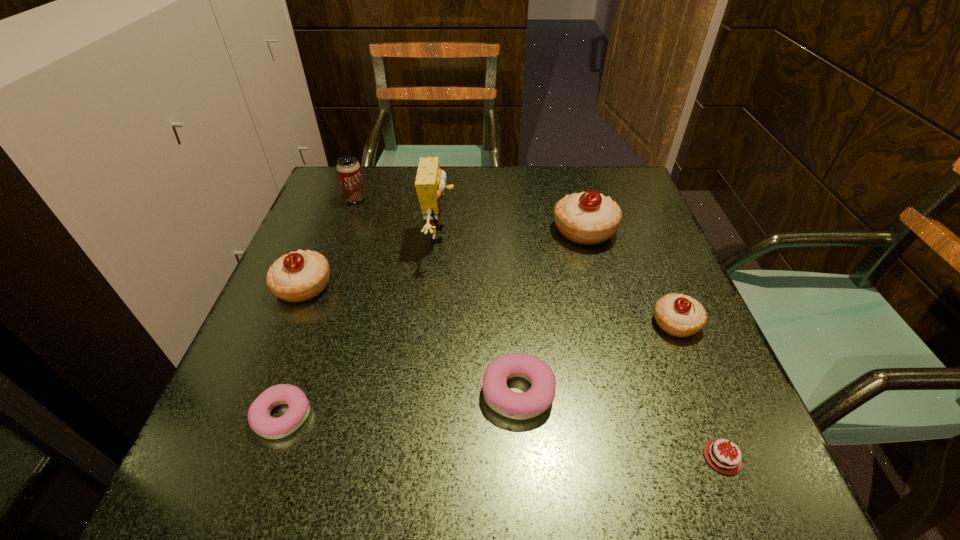
I want to click on object located at the far left corner, so click(349, 171).

What are the coordinates of `object that is at the near left corner` in the screenshot? It's located at (260, 421).

Locate an element on the screen. The height and width of the screenshot is (540, 960). object located in the far right corner section of the desktop is located at coordinates (x=588, y=218).

The height and width of the screenshot is (540, 960). What are the coordinates of `object that is at the near right corner` in the screenshot? It's located at (723, 461).

This screenshot has width=960, height=540. Find the location of `free space at the far edge`. free space at the far edge is located at coordinates (513, 177).

This screenshot has height=540, width=960. I want to click on vacant area at the left edge of the desktop, so click(x=316, y=241).

In the image, there is a desktop. What are the coordinates of `blank space at the right edge` in the screenshot? It's located at (734, 410).

Image resolution: width=960 pixels, height=540 pixels. I want to click on free space at the far left corner of the desktop, so (x=319, y=217).

Locate an element on the screen. This screenshot has height=540, width=960. vacant space at the far right corner of the desktop is located at coordinates (628, 167).

The image size is (960, 540). In order to click on vacant area that lies between the beer can and the tallest object in this screenshot , I will do `click(397, 217)`.